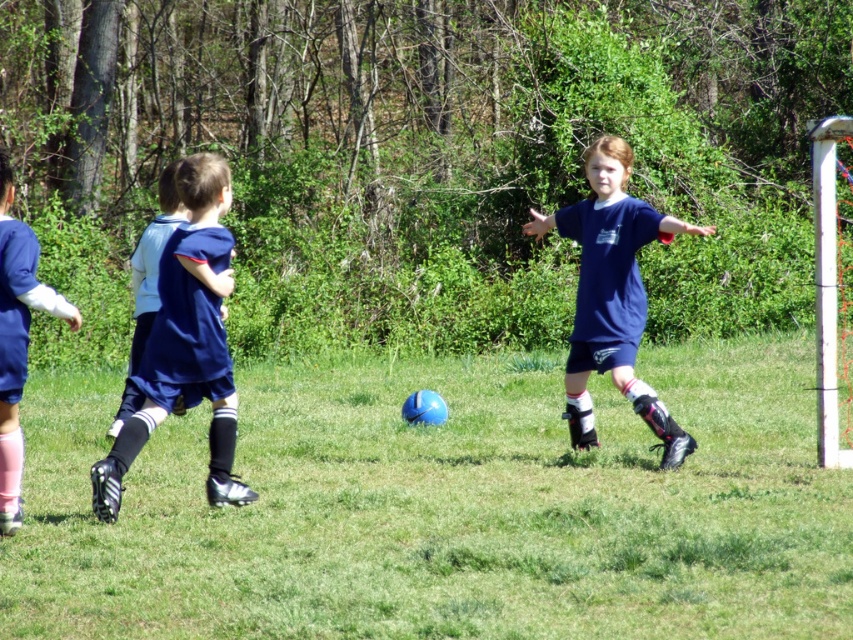
Which is above, dark blue jersey at center or blue fabric shorts at left?

blue fabric shorts at left is higher up.

Is point (114, 513) positioned behind point (175, 216)?

No.

Find the location of a particular element. The image size is (853, 640). dark blue jersey at center is located at coordinates (186, 340).

Which of these two, dark blue jersey at center or blue jersey at left, stands shorter?

dark blue jersey at center

Does dark blue jersey at center lie behind blue jersey at left?

Yes, it is.

This screenshot has width=853, height=640. I want to click on dark blue jersey at center, so click(x=186, y=340).

This screenshot has width=853, height=640. Find the location of `dark blue jersey at center`. dark blue jersey at center is located at coordinates (186, 340).

Can you confirm if green grass at center is positioned above dark blue jersey at center?

Incorrect, green grass at center is not positioned above dark blue jersey at center.

You are a GUI agent. You are given a task and a screenshot of the screen. Output one action in this format:
    pyautogui.click(x=<x>, y=<y>)
    Task: Click on the green grass at center
    
    Given the screenshot: What is the action you would take?
    pyautogui.click(x=444, y=508)